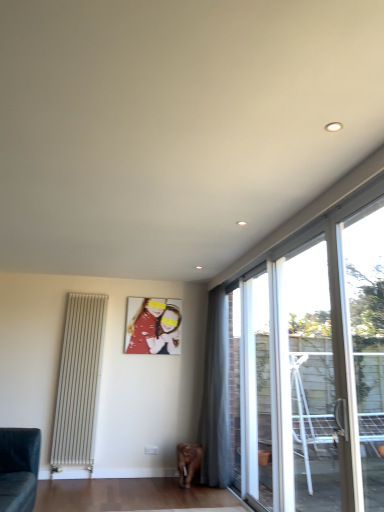
Question: Does transparent glass window at right, which ranks as the third window in front-to-back order, turn towards matte red photo frame at center?

Choices:
 (A) no
 (B) yes

Answer: (A)

Question: Does transparent glass window at right, which ranks as the third window in front-to-back order, contain matte red photo frame at center?

Choices:
 (A) no
 (B) yes

Answer: (A)

Question: Is transparent glass window at right, which ranks as the third window in front-to-back order, oriented away from matte red photo frame at center?

Choices:
 (A) no
 (B) yes

Answer: (A)

Question: Is transparent glass window at right, which ranks as the third window in front-to-back order, bigger than matte red photo frame at center?

Choices:
 (A) yes
 (B) no

Answer: (A)

Question: Is transparent glass window at right, which ranks as the first window in back-to-front order, outside matte red photo frame at center?

Choices:
 (A) no
 (B) yes

Answer: (B)

Question: Looking at their shapes, would you say dark gray fabric couch at lower left is wider or thinner than matte red photo frame at center?

Choices:
 (A) wide
 (B) thin

Answer: (A)

Question: Is dark gray fabric couch at lower left taller or shorter than matte red photo frame at center?

Choices:
 (A) short
 (B) tall

Answer: (B)

Question: Does point (3, 440) appear closer or farther from the camera than point (140, 352)?

Choices:
 (A) closer
 (B) farther

Answer: (A)

Question: From the image's perspective, is dark gray fabric couch at lower left above or below matte red photo frame at center?

Choices:
 (A) below
 (B) above

Answer: (A)

Question: Looking at their shapes, would you say matte red photo frame at center is wider or thinner than transparent glass door at right, which is the 2th window from front to back?

Choices:
 (A) wide
 (B) thin

Answer: (B)

Question: Is matte red photo frame at center to the left or to the right of transparent glass door at right, which is the 2th window from back to front, in the image?

Choices:
 (A) right
 (B) left

Answer: (B)

Question: Is matte red photo frame at center in front of or behind transparent glass door at right, which is the 2th window from front to back, in the image?

Choices:
 (A) behind
 (B) front

Answer: (A)

Question: From the image's perspective, is matte red photo frame at center above or below transparent glass door at right, which is the 2th window from back to front?

Choices:
 (A) above
 (B) below

Answer: (B)

Question: From a real-world perspective, relative to transparent glass door at upper right, the third window from the back, is transparent glass window at right, which ranks as the third window in front-to-back order, vertically above or below?

Choices:
 (A) below
 (B) above

Answer: (A)

Question: From their relative heights in the image, would you say transparent glass window at right, which ranks as the first window in back-to-front order, is taller or shorter than transparent glass door at upper right, the third window from the back?

Choices:
 (A) tall
 (B) short

Answer: (A)